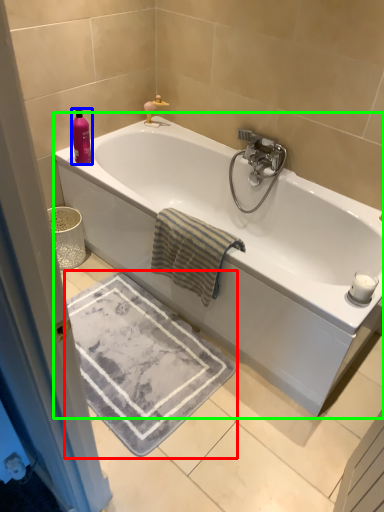
Question: Considering the real-world distances, which object is closest to bath mat (highlighted by a red box)? toiletry (highlighted by a blue box) or bathtub (highlighted by a green box).

Choices:
 (A) toiletry
 (B) bathtub

Answer: (B)